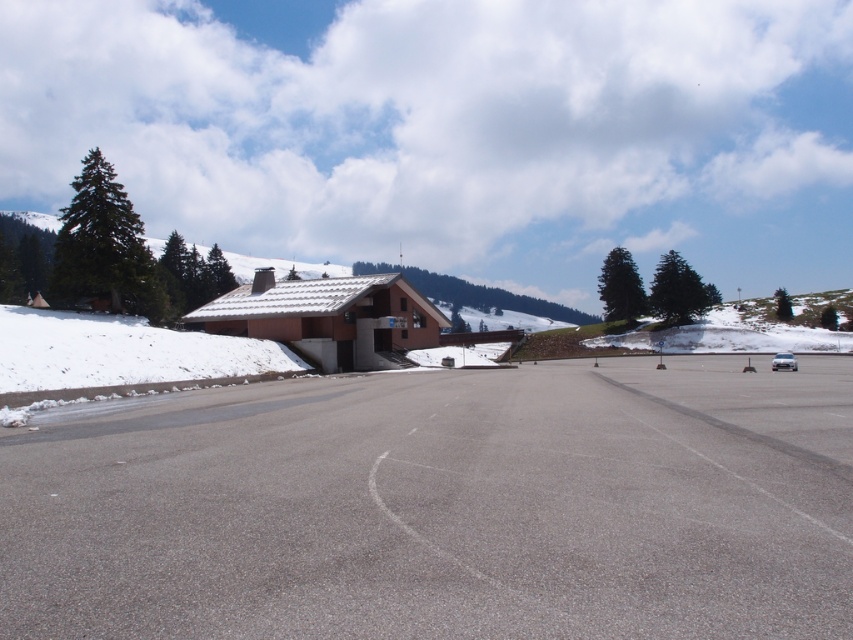
You are a hiker who wants to take a photo of the white snow at left and the green matte pine at left. Which object should you focus on first if you want both to be in sharp focus?

You should focus on the green matte pine at left first because it is closer to the camera than the white snow at left, ensuring both will be in focus when using proper depth of field.

You are a delivery driver who needs to park your vehicle in the parking lot. Your truck is 18 meters long. There is a white snow at left and a green matte pine at left. Can you safely park your truck between these two objects without any part of the truck extending beyond them?

The distance between the white snow at left and the green matte pine at left is 18.18 meters. Since your truck is 18 meters long, it can fit within the space as there is enough room between them.

Consider the image. You are a hiker planning to park your car in the parking lot. You notice the white snow at left and the green matte pine at left. Which object takes up more space in the scene?

The green matte pine at left takes up more space in the scene because the white snow at left has a smaller size compared to it.